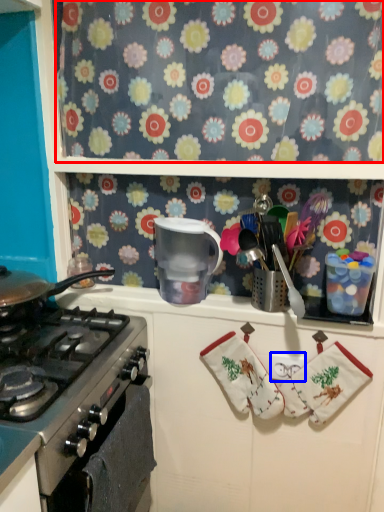
Question: Which of the following is the closest to the observer, flower (highlighted by a red box) or tile (highlighted by a blue box)?

Choices:
 (A) flower
 (B) tile

Answer: (A)